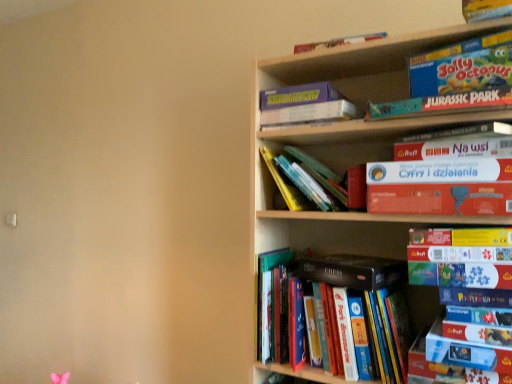
Question: Is matte yellow puzzle box at right, the 8th book in the top-to-bottom sequence, looking in the opposite direction of purple cardboard game at upper center, which appears as the 10th book when ordered from the bottom?

Choices:
 (A) no
 (B) yes

Answer: (A)

Question: From the image's perspective, does matte yellow puzzle box at right, the 8th book in the top-to-bottom sequence, appear higher than purple cardboard game at upper center, the third book in the top-to-bottom sequence?

Choices:
 (A) yes
 (B) no

Answer: (B)

Question: Does matte yellow puzzle box at right, positioned as the 5th book in bottom-to-top order, have a smaller size compared to purple cardboard game at upper center, the third book in the top-to-bottom sequence?

Choices:
 (A) no
 (B) yes

Answer: (A)

Question: Can we say matte yellow puzzle box at right, positioned as the 5th book in bottom-to-top order, lies outside purple cardboard game at upper center, which appears as the 10th book when ordered from the bottom?

Choices:
 (A) yes
 (B) no

Answer: (A)

Question: Is the depth of matte yellow puzzle box at right, the 8th book in the top-to-bottom sequence, greater than that of purple cardboard game at upper center, the third book in the top-to-bottom sequence?

Choices:
 (A) no
 (B) yes

Answer: (A)

Question: From their relative heights in the image, would you say teal cardboard jurassic park book at upper right, the fifth book viewed from the top, is taller or shorter than white cardboard book at upper right, which appears as the seventh book when ordered from the bottom?

Choices:
 (A) tall
 (B) short

Answer: (B)

Question: Considering their positions, is teal cardboard jurassic park book at upper right, the fifth book viewed from the top, located in front of or behind white cardboard book at upper right, acting as the sixth book starting from the top?

Choices:
 (A) behind
 (B) front

Answer: (B)

Question: Is teal cardboard jurassic park book at upper right, which is the 8th book in bottom-to-top order, bigger or smaller than white cardboard book at upper right, acting as the sixth book starting from the top?

Choices:
 (A) small
 (B) big

Answer: (B)

Question: Considering the positions of teal cardboard jurassic park book at upper right, the fifth book viewed from the top, and white cardboard book at upper right, which appears as the seventh book when ordered from the bottom, in the image, is teal cardboard jurassic park book at upper right, the fifth book viewed from the top, wider or thinner than white cardboard book at upper right, which appears as the seventh book when ordered from the bottom,?

Choices:
 (A) wide
 (B) thin

Answer: (A)

Question: In terms of height, does hardcover books at center, which is the 12th book in top-to-bottom order, look taller or shorter compared to matte board game at upper right, marked as the 2th book in a top-to-bottom arrangement?

Choices:
 (A) short
 (B) tall

Answer: (B)

Question: Looking at the image, does hardcover books at center, which ranks as the first book in bottom-to-top order, seem bigger or smaller compared to matte board game at upper right, marked as the 2th book in a top-to-bottom arrangement?

Choices:
 (A) big
 (B) small

Answer: (A)

Question: Does point (350, 360) appear closer or farther from the camera than point (444, 49)?

Choices:
 (A) closer
 (B) farther

Answer: (B)

Question: From a real-world perspective, is hardcover books at center, which is the 12th book in top-to-bottom order, physically located above or below matte board game at upper right, marked as the 2th book in a top-to-bottom arrangement?

Choices:
 (A) above
 (B) below

Answer: (B)

Question: Considering the positions of hardcover chess book at center, which is the first paperback book in bottom-to-top order, and matte cardboard book at lower right, the 2th book positioned from the bottom, in the image, is hardcover chess book at center, which is the first paperback book in bottom-to-top order, bigger or smaller than matte cardboard book at lower right, the 2th book positioned from the bottom,?

Choices:
 (A) small
 (B) big

Answer: (B)

Question: From the image's perspective, is hardcover chess book at center, which ranks as the 2th paperback book in top-to-bottom order, positioned above or below matte cardboard book at lower right, the 2th book positioned from the bottom?

Choices:
 (A) below
 (B) above

Answer: (B)